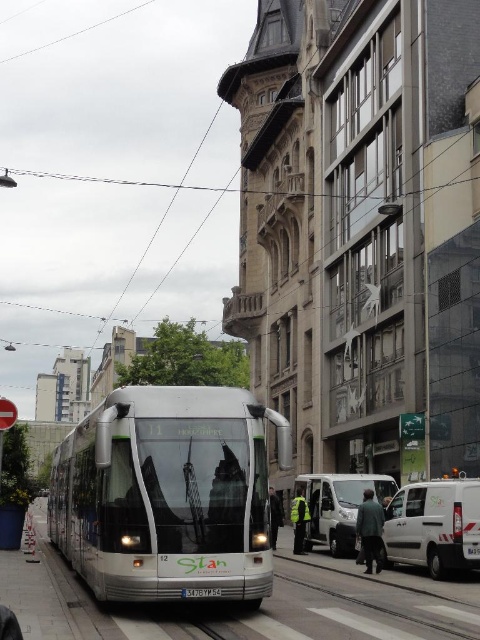
Question: Can you confirm if silver metallic bus at center is positioned above white matte van at lower center?

Choices:
 (A) yes
 (B) no

Answer: (A)

Question: Does silver metallic bus at center appear over white matte van at lower center?

Choices:
 (A) no
 (B) yes

Answer: (B)

Question: Does silver metallic bus at center have a larger size compared to white matte van at lower right?

Choices:
 (A) yes
 (B) no

Answer: (A)

Question: Which object is farther from the camera taking this photo?

Choices:
 (A) silver metallic bus at center
 (B) white matte van at lower right
 (C) white matte van at lower center

Answer: (C)

Question: Which point appears farthest from the camera in this image?

Choices:
 (A) (338, 508)
 (B) (467, 550)

Answer: (A)

Question: Which object is positioned closest to the silver metallic bus at center?

Choices:
 (A) white matte van at lower right
 (B) white matte van at lower center

Answer: (A)